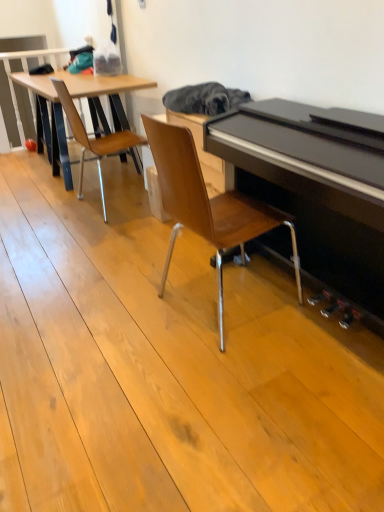
This screenshot has height=512, width=384. In order to click on vacant region to the left of wooden chair at center, which appears as the second chair when viewed from the left in this screenshot , I will do `click(111, 312)`.